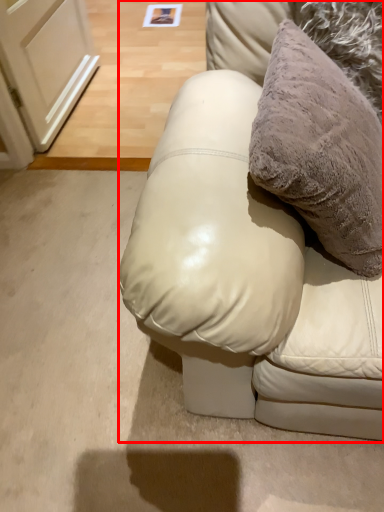
Question: Considering the relative positions of furniture (annotated by the red box) and pillow in the image provided, where is furniture (annotated by the red box) located with respect to the staircase?

Choices:
 (A) right
 (B) left

Answer: (B)